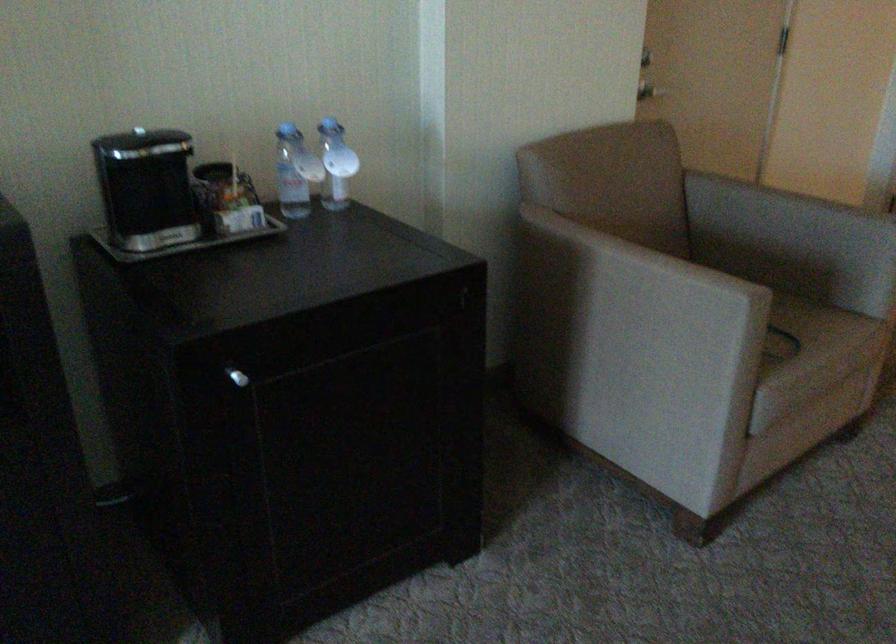
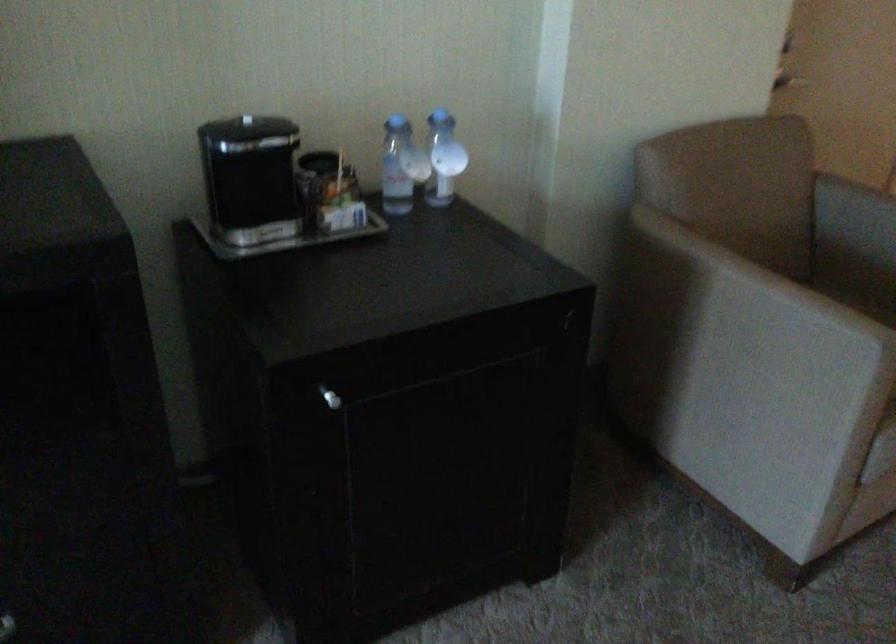
Find the pixel in the second image that matches point 293,167 in the first image.

(401, 166)